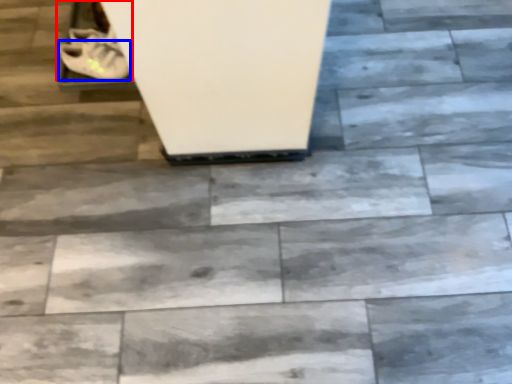
Question: Among these objects, which one is farthest to the camera, footwear (highlighted by a red box) or shoe (highlighted by a blue box)?

Choices:
 (A) footwear
 (B) shoe

Answer: (A)